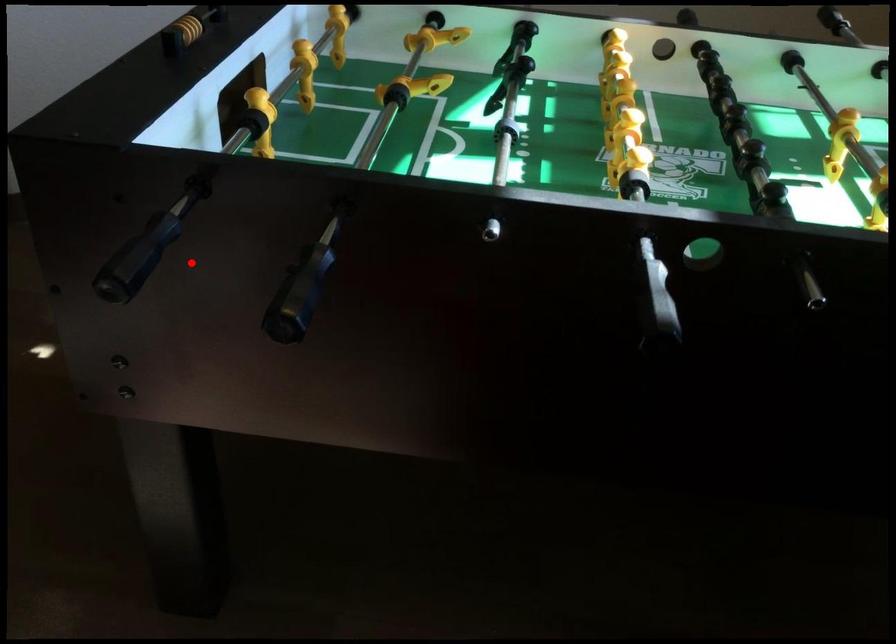
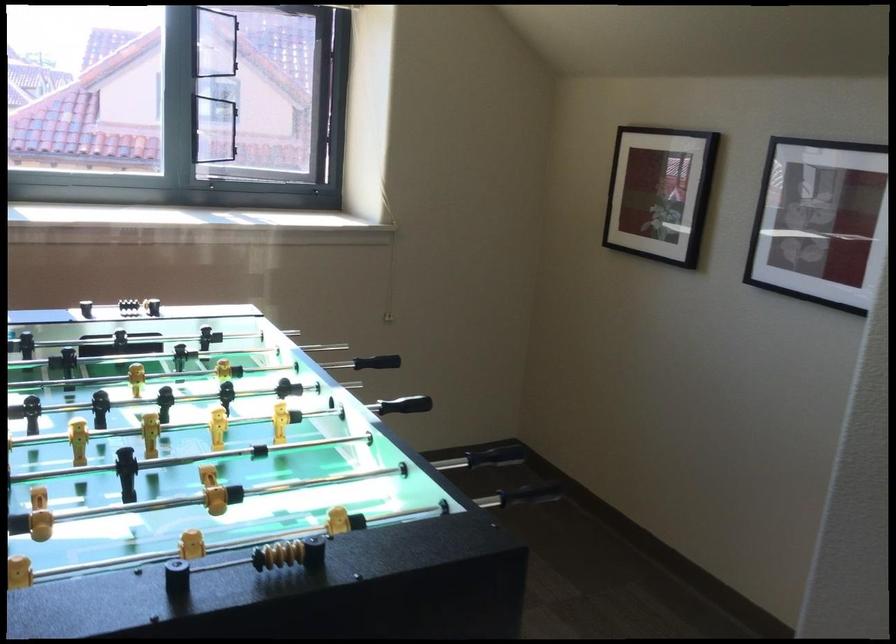
Find the pixel in the second image that matches the highlighted location in the first image.

(531, 493)